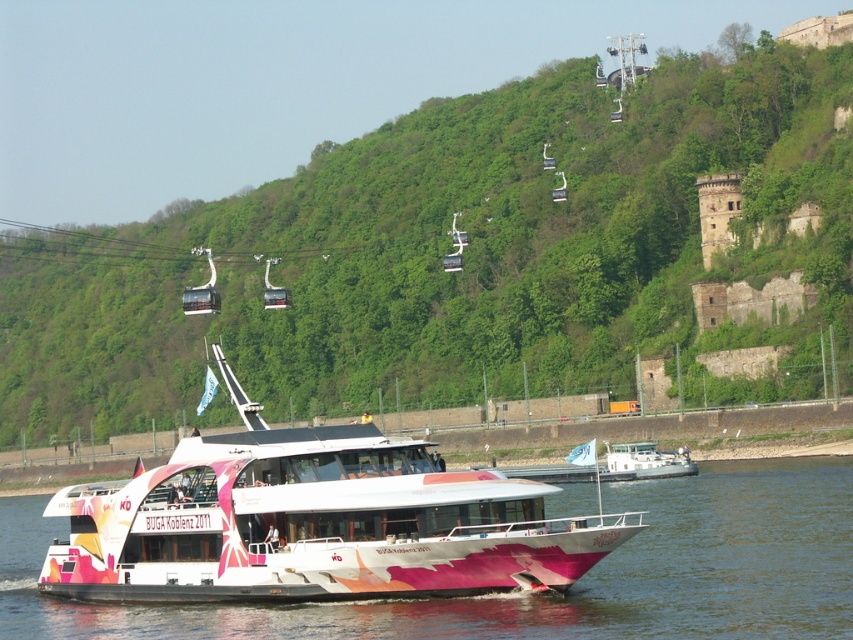
Question: Observing the image, what is the correct spatial positioning of green leafy hillside at upper center in reference to pink glossy boat at lower center?

Choices:
 (A) left
 (B) right

Answer: (A)

Question: Which object is the farthest from the white glossy boat at center?

Choices:
 (A) pink glossy boat at lower center
 (B) green leafy hillside at upper center

Answer: (B)

Question: Which point is farther from the camera taking this photo?

Choices:
 (A) [820, 632]
 (B) [550, 563]

Answer: (B)

Question: Does green leafy hillside at upper center lie behind pink glossy boat at lower center?

Choices:
 (A) yes
 (B) no

Answer: (A)

Question: Which object is the farthest from the white glossy boat at center?

Choices:
 (A) green leafy hillside at upper center
 (B) pink glossy boat at lower center

Answer: (A)

Question: Considering the relative positions of white glossy boat at center and pink glossy boat at lower center in the image provided, where is white glossy boat at center located with respect to pink glossy boat at lower center?

Choices:
 (A) right
 (B) left

Answer: (A)